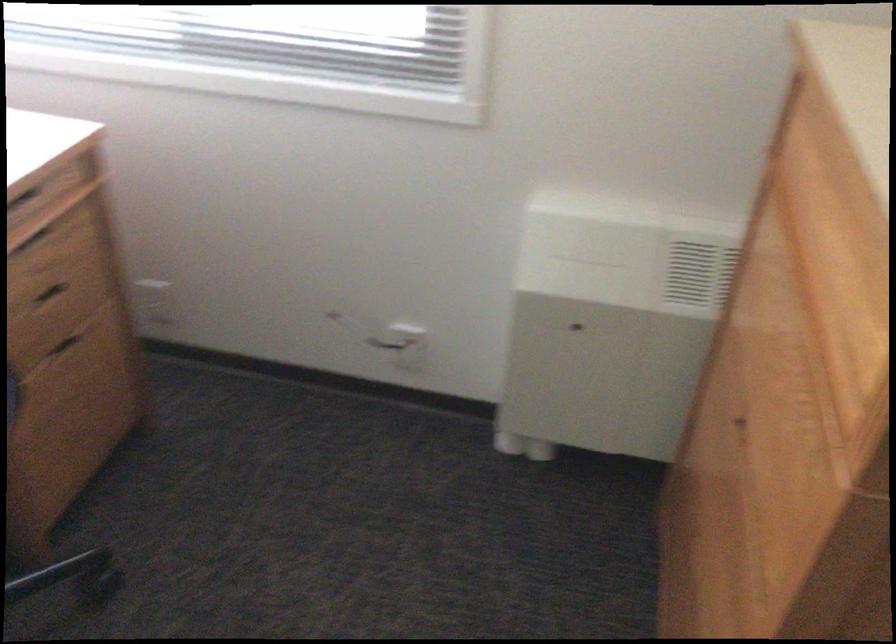
Locate an element on the screen. This screenshot has height=644, width=896. wall outlet socket is located at coordinates (409, 345).